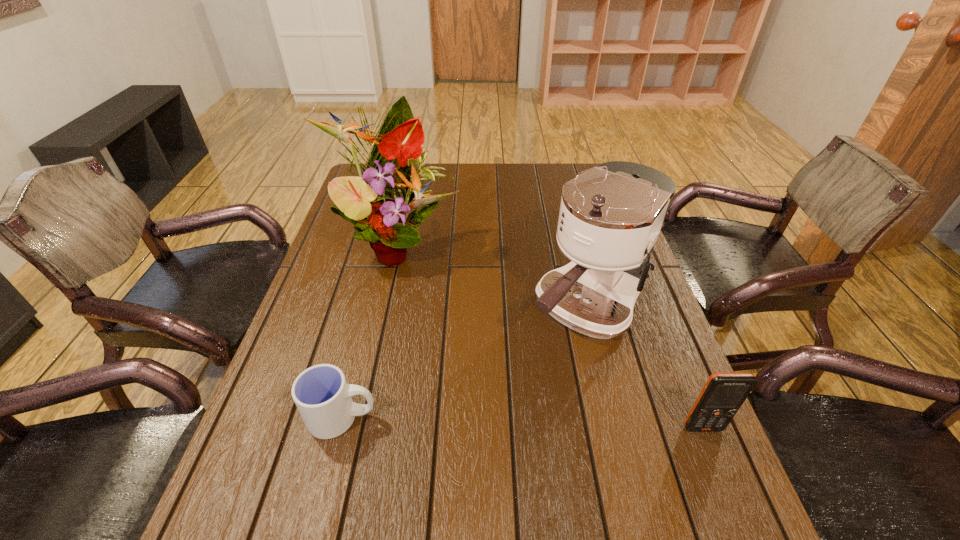
Identify the location of blank region between the cellular telephone and the bouquet. This screenshot has width=960, height=540. click(550, 335).

Where is `vacant area between the second shortest object and the coffee maker`? vacant area between the second shortest object and the coffee maker is located at coordinates (645, 368).

Locate an element on the screen. The width and height of the screenshot is (960, 540). object that is the closest one to the third tallest object is located at coordinates (610, 217).

Locate which object ranks in proximity to the second shortest object. Please provide its 2D coordinates. Your answer should be formatted as a tuple, i.e. [(x, y)], where the tuple contains the x and y coordinates of a point satisfying the conditions above.

[(610, 217)]